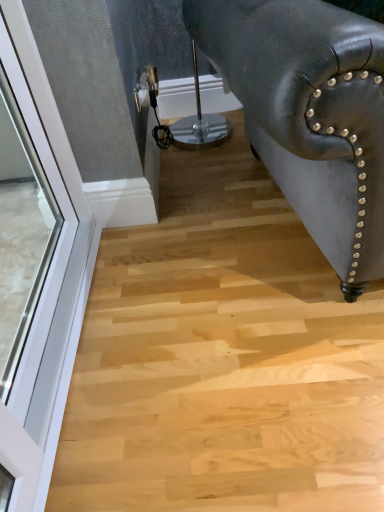
Question: Visually, is matte black leather armchair at right positioned to the left or to the right of white glass window at left?

Choices:
 (A) right
 (B) left

Answer: (A)

Question: From a real-world perspective, is matte black leather armchair at right above or below white glass window at left?

Choices:
 (A) above
 (B) below

Answer: (A)

Question: From their relative heights in the image, would you say matte black leather armchair at right is taller or shorter than white glass window at left?

Choices:
 (A) tall
 (B) short

Answer: (A)

Question: Is point (36, 407) positioned closer to the camera than point (198, 27)?

Choices:
 (A) closer
 (B) farther

Answer: (A)

Question: Is white glass window at left bigger or smaller than matte black leather armchair at right?

Choices:
 (A) small
 (B) big

Answer: (A)

Question: Considering their positions, is white glass window at left located in front of or behind matte black leather armchair at right?

Choices:
 (A) behind
 (B) front

Answer: (A)

Question: In terms of height, does white glass window at left look taller or shorter compared to matte black leather armchair at right?

Choices:
 (A) short
 (B) tall

Answer: (A)